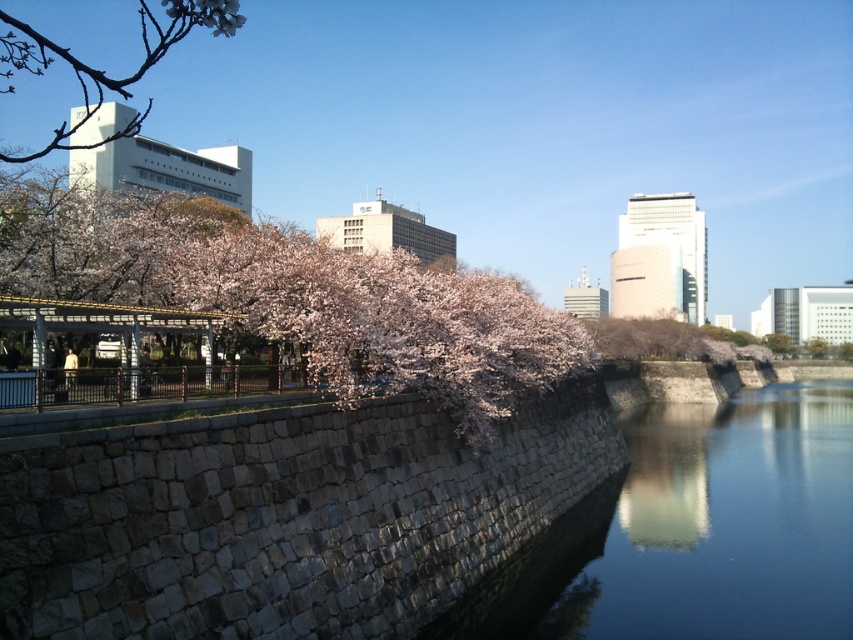
You are a photographer standing on the smooth stone river at center, aiming to capture the pink petal blossom at upper left in your shot. Will the blossom be visible through the river?

The pink petal blossom at upper left is behind the smooth stone river at center, so it will not be visible through the river from your position.

You are a photographer trying to capture the entire scene of the smooth stone river at center and the pink petal blossom at upper left in one shot. Based on their sizes in the image, which object would you need to zoom out more to include fully?

The pink petal blossom at upper left occupies more space in the image than the smooth stone river at center, so you would need to zoom out more to include the pink petal blossom at upper left fully.

You are standing at point (x=25, y=33) and want to walk to point (x=764, y=483). Based on the scene description, will you have a clear path to walk directly towards your destination?

Point (x=764, y=483) is in front of point (x=25, y=33), so yes, you will have a clear path to walk directly towards your destination since it is closer to you than the other point.